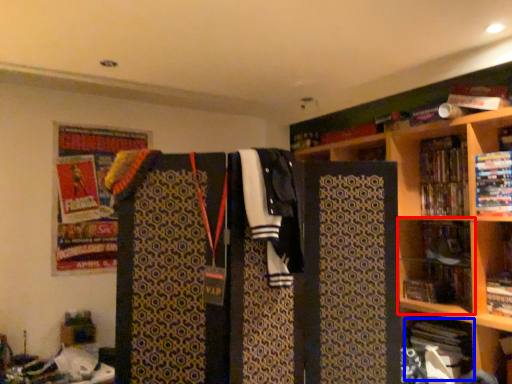
Question: Which object is further to the camera taking this photo, shelf (highlighted by a red box) or book (highlighted by a blue box)?

Choices:
 (A) shelf
 (B) book

Answer: (A)